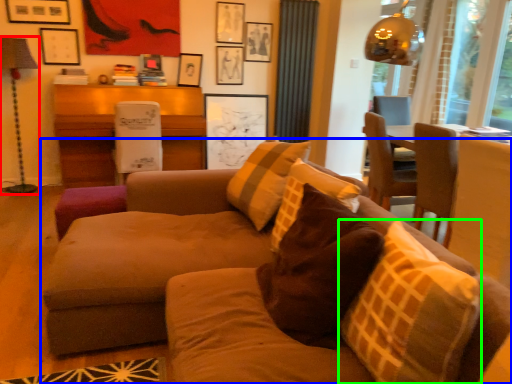
Question: Which object is positioned closest to lamp (highlighted by a red box)? Select from studio couch (highlighted by a blue box) and throw pillow (highlighted by a green box).

Choices:
 (A) studio couch
 (B) throw pillow

Answer: (A)